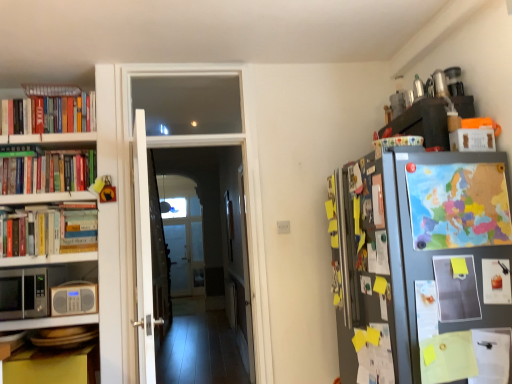
The width and height of the screenshot is (512, 384). Find the location of `free space above white wooden door at center (from a real-world perspective)`. free space above white wooden door at center (from a real-world perspective) is located at coordinates tap(183, 59).